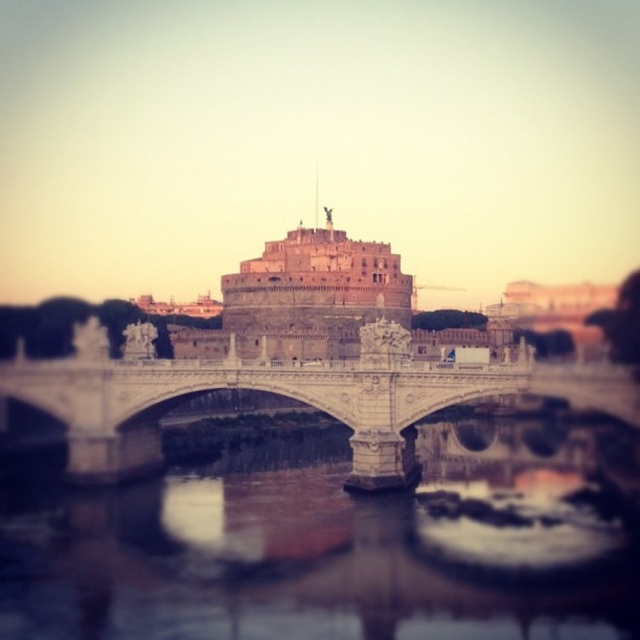
Question: From the image, what is the correct spatial relationship of brown reflective water at center in relation to white stone bridge at center?

Choices:
 (A) above
 (B) below

Answer: (B)

Question: Does brown reflective water at center have a smaller size compared to white stone bridge at center?

Choices:
 (A) yes
 (B) no

Answer: (A)

Question: Among these objects, which one is nearest to the camera?

Choices:
 (A) white stone bridge at center
 (B) brown reflective water at center

Answer: (B)

Question: Can you confirm if brown reflective water at center is smaller than white stone bridge at center?

Choices:
 (A) yes
 (B) no

Answer: (A)